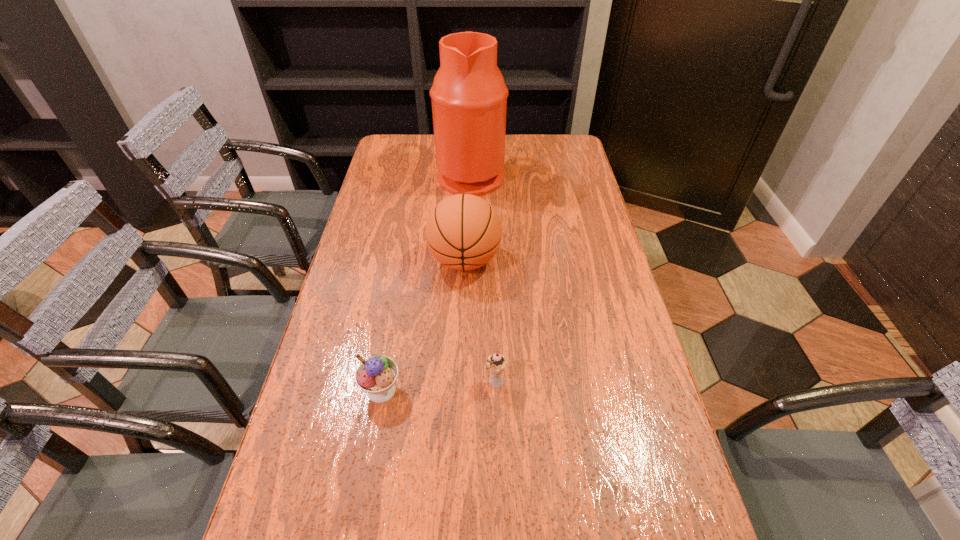
Image resolution: width=960 pixels, height=540 pixels. I want to click on object positioned at the far edge, so click(x=469, y=96).

Identify the location of object that is at the left edge. (377, 375).

Find the location of `vacant space at the far edge of the desktop`. vacant space at the far edge of the desktop is located at coordinates (519, 136).

In the image, there is a desktop. Where is `vacant space at the left edge`? Image resolution: width=960 pixels, height=540 pixels. vacant space at the left edge is located at coordinates (321, 367).

Find the location of a particular element. The height and width of the screenshot is (540, 960). free location at the right edge is located at coordinates (589, 219).

Where is `vacant space at the far right corner of the desktop`? This screenshot has height=540, width=960. vacant space at the far right corner of the desktop is located at coordinates (563, 165).

Identify the location of free spot between the tallest object and the leftmost object. This screenshot has height=540, width=960. (426, 282).

Where is `vacant space in between the second farthest object and the right icecream`? The width and height of the screenshot is (960, 540). vacant space in between the second farthest object and the right icecream is located at coordinates (480, 322).

This screenshot has width=960, height=540. Find the location of `vacant region between the right icecream and the tallest object`. vacant region between the right icecream and the tallest object is located at coordinates (484, 279).

You are a GUI agent. You are given a task and a screenshot of the screen. Output one action in this format:
    pyautogui.click(x=<x>, y=<y>)
    Task: Click on the empty space that is in between the right icecream and the leftmost object
    The image size is (960, 540).
    Given the screenshot: What is the action you would take?
    pyautogui.click(x=439, y=387)